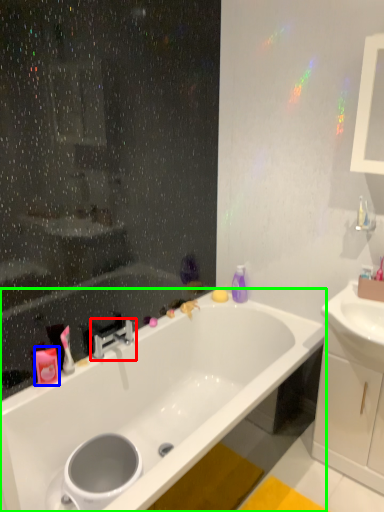
Question: Which object is the farthest from tap (highlighted by a red box)? Choose among these: toiletry (highlighted by a blue box) or bathtub (highlighted by a green box).

Choices:
 (A) toiletry
 (B) bathtub

Answer: (B)